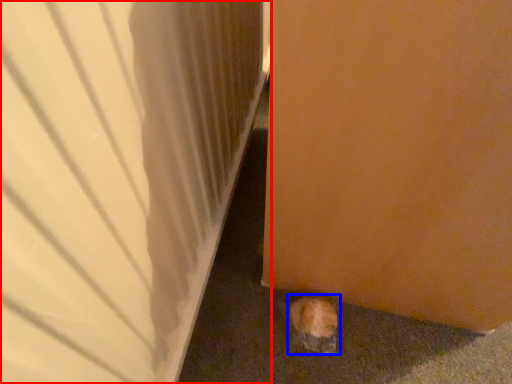
Question: Which point is further to the camera, door (highlighted by a red box) or animal (highlighted by a blue box)?

Choices:
 (A) door
 (B) animal

Answer: (B)